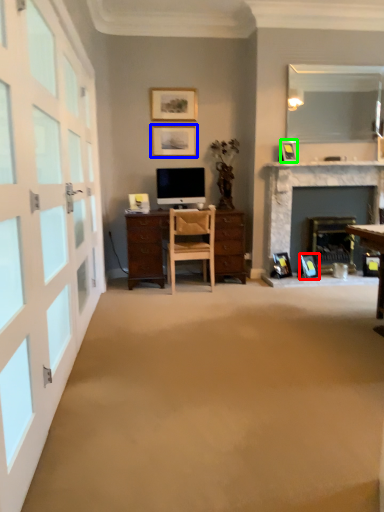
Question: Estimate the real-world distances between objects in this image. Which object is farther from picture frame (highlighted by a red box), picture frame (highlighted by a blue box) or picture frame (highlighted by a green box)?

Choices:
 (A) picture frame
 (B) picture frame

Answer: (A)